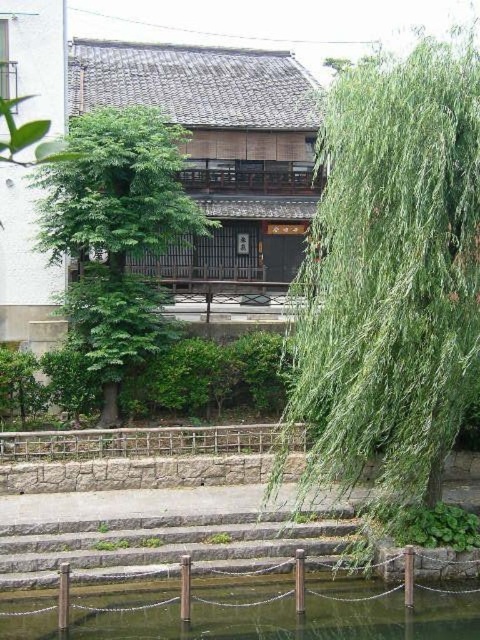
Between green leafy willow at right and green leafy tree at center, which one is positioned lower?

green leafy willow at right is below.

Is green leafy willow at right positioned behind green leafy tree at center?

No, green leafy willow at right is in front of green leafy tree at center.

Who is more distant from viewer, (403, 168) or (126, 172)?

Point (126, 172)

Identify the location of green leafy willow at right. This screenshot has height=640, width=480. (391, 278).

Is clear glass water at lower center closer to camera compared to stone steps at center?

Yes.

This screenshot has width=480, height=640. What are the coordinates of `clear glass water at lower center` in the screenshot? It's located at tap(253, 614).

Who is more distant from viewer, (424, 435) or (210, 552)?

Point (210, 552)

Is point (403, 100) less distant than point (215, 570)?

Yes, it is.

This screenshot has height=640, width=480. In order to click on green leafy willow at right in this screenshot , I will do `click(391, 278)`.